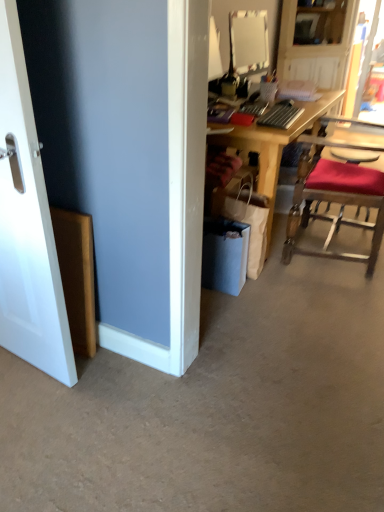
This screenshot has width=384, height=512. What do you see at coordinates (275, 145) in the screenshot? I see `wooden desk at center` at bounding box center [275, 145].

The width and height of the screenshot is (384, 512). What do you see at coordinates (338, 189) in the screenshot?
I see `wooden chair with red cushion at right` at bounding box center [338, 189].

Based on the photo, what is the approximate height of wooden chair with red cushion at right?

The height of wooden chair with red cushion at right is 99.42 centimeters.

The image size is (384, 512). Describe the element at coordinates (217, 407) in the screenshot. I see `gray carpet at lower center` at that location.

What are the coordinates of `wooden desk at center` in the screenshot? It's located at (275, 145).

From a real-world perspective, which object rests below the other?

gray carpet at lower center.

Measure the distance from gray carpet at lower center to wooden desk at upper right.

gray carpet at lower center and wooden desk at upper right are 3.26 meters apart.

Is point (300, 278) positioned behind point (282, 20)?

No.

Is gray carpet at lower center inside the boundaries of wooden desk at upper right, or outside?

gray carpet at lower center is located beyond the bounds of wooden desk at upper right.

Considering the relative sizes of white smooth door at left and wooden desk at upper right in the image provided, is white smooth door at left smaller than wooden desk at upper right?

Correct, white smooth door at left occupies less space than wooden desk at upper right.

Considering the relative positions of white smooth door at left and wooden desk at upper right in the image provided, is white smooth door at left to the right of wooden desk at upper right from the viewer's perspective?

No, white smooth door at left is not to the right of wooden desk at upper right.

Does point (4, 120) come behind point (301, 22)?

No.

In terms of width, does white smooth door at left look wider or thinner when compared to wooden desk at upper right?

white smooth door at left is thinner than wooden desk at upper right.

Which object is further away from the camera, wooden desk at center or white smooth door at left?

wooden desk at center is more distant.

From the image's perspective, is wooden desk at center above or below white smooth door at left?

Clearly, from the image's perspective, wooden desk at center is above white smooth door at left.

From the picture: Is wooden desk at center inside the boundaries of white smooth door at left, or outside?

wooden desk at center exists outside the volume of white smooth door at left.

Can you tell me how much wooden desk at center and white smooth door at left differ in facing direction?

There is a 94.5-degree angle between the facing directions of wooden desk at center and white smooth door at left.

Is wooden desk at upper right oriented towards gray carpet at lower center?

No, wooden desk at upper right is not oriented towards gray carpet at lower center.

In order to click on concrete located in front of the wooden desk at upper right in this screenshot , I will do point(217,407).

How different are the orientations of wooden desk at upper right and gray carpet at lower center in degrees?

There is a 128-degree angle between the facing directions of wooden desk at upper right and gray carpet at lower center.

Is wooden desk at upper right bigger or smaller than gray carpet at lower center?

wooden desk at upper right is bigger than gray carpet at lower center.

Between wooden desk at center and wooden desk at upper right, which one has larger size?

wooden desk at center is bigger.

Which object is positioned more to the left, wooden desk at center or wooden desk at upper right?

wooden desk at center.

Does wooden desk at center have a greater height compared to wooden chair with red cushion at right?

In fact, wooden desk at center may be shorter than wooden chair with red cushion at right.

From a real-world perspective, is wooden desk at center positioned under wooden chair with red cushion at right based on gravity?

Yes, from a real-world perspective, wooden desk at center is below wooden chair with red cushion at right.

The image size is (384, 512). Find the location of `desk located on the left of wooden chair with red cushion at right`. desk located on the left of wooden chair with red cushion at right is located at coordinates (275, 145).

Consider the image. Is wooden desk at center directly adjacent to wooden chair with red cushion at right?

wooden desk at center and wooden chair with red cushion at right are clearly separated.

Is wooden chair with red cushion at right far away from wooden desk at upper right?

wooden chair with red cushion at right is far away from wooden desk at upper right.

Consider the image. Is wooden desk at upper right a part of wooden chair with red cushion at right?

No, wooden desk at upper right is not inside wooden chair with red cushion at right.

Considering the relative positions of wooden chair with red cushion at right and wooden desk at upper right in the image provided, is wooden chair with red cushion at right in front of wooden desk at upper right?

Yes, it is in front of wooden desk at upper right.

Is wooden desk at upper right at the back of wooden chair with red cushion at right?

No, wooden chair with red cushion at right is not facing the opposite direction of wooden desk at upper right.

The width and height of the screenshot is (384, 512). I want to click on dresser on the right of the gray carpet at lower center, so click(x=318, y=42).

You are a GUI agent. You are given a task and a screenshot of the screen. Output one action in this format:
    pyautogui.click(x=<x>, y=<y>)
    Task: Click on the dresser behind the white smooth door at left
    The width and height of the screenshot is (384, 512).
    Given the screenshot: What is the action you would take?
    pyautogui.click(x=318, y=42)

Looking at the image, which one is located further to wooden desk at center, wooden desk at upper right or gray carpet at lower center?

Based on the image, wooden desk at upper right appears to be further to wooden desk at center.

When comparing their distances from gray carpet at lower center, does wooden desk at upper right or white smooth door at left seem further?

The object further to gray carpet at lower center is wooden desk at upper right.

Estimate the real-world distances between objects in this image. Which object is closer to wooden chair with red cushion at right, white smooth door at left or gray carpet at lower center?

gray carpet at lower center is closer to wooden chair with red cushion at right.

Consider the image. Which object lies further to the anchor point wooden desk at center, white smooth door at left or wooden chair with red cushion at right?

white smooth door at left lies further to wooden desk at center than the other object.

Looking at the image, which one is located closer to wooden desk at center, gray carpet at lower center or wooden desk at upper right?

gray carpet at lower center is positioned closer to the anchor wooden desk at center.

Looking at the image, which one is located closer to wooden desk at center, wooden desk at upper right or wooden chair with red cushion at right?

Among the two, wooden chair with red cushion at right is located nearer to wooden desk at center.

Based on their spatial positions, is wooden desk at center or wooden chair with red cushion at right closer to gray carpet at lower center?

Based on the image, wooden desk at center appears to be nearer to gray carpet at lower center.

Considering their positions, is wooden chair with red cushion at right positioned closer to white smooth door at left than gray carpet at lower center?

The object closer to white smooth door at left is gray carpet at lower center.

You are a GUI agent. You are given a task and a screenshot of the screen. Output one action in this format:
    pyautogui.click(x=<x>, y=<y>)
    Task: Click on the desk between wooden chair with red cushion at right and wooden desk at upper right from front to back
    Image resolution: width=384 pixels, height=512 pixels.
    Given the screenshot: What is the action you would take?
    pyautogui.click(x=275, y=145)

Image resolution: width=384 pixels, height=512 pixels. What are the coordinates of `desk between white smooth door at left and wooden desk at upper right from front to back` in the screenshot? It's located at (275, 145).

The image size is (384, 512). I want to click on chair between gray carpet at lower center and wooden desk at upper right along the z-axis, so click(x=338, y=189).

At what (x,y) coordinates should I click in order to perform the action: click on door between wooden desk at center and gray carpet at lower center in the up-down direction. Please return your answer as a coordinate pair (x, y). This screenshot has width=384, height=512. Looking at the image, I should click on pos(27,225).